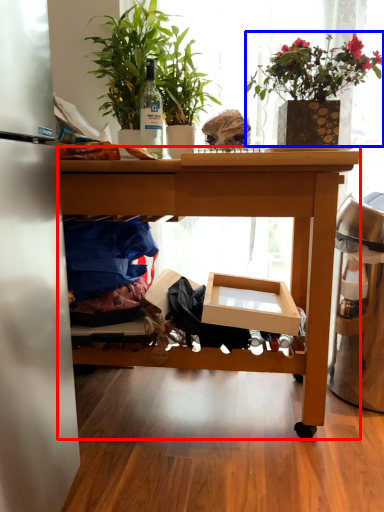
Question: Among these objects, which one is farthest to the camera, desk (highlighted by a red box) or houseplant (highlighted by a blue box)?

Choices:
 (A) desk
 (B) houseplant

Answer: (B)